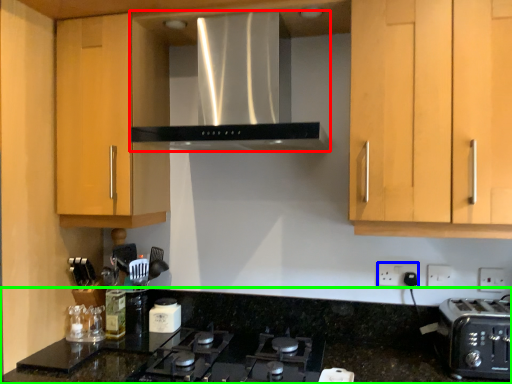
Question: Based on their relative distances, which object is nearer to home appliance (highlighted by a red box)? Choose from electric outlet (highlighted by a blue box) and countertop (highlighted by a green box).

Choices:
 (A) electric outlet
 (B) countertop

Answer: (B)